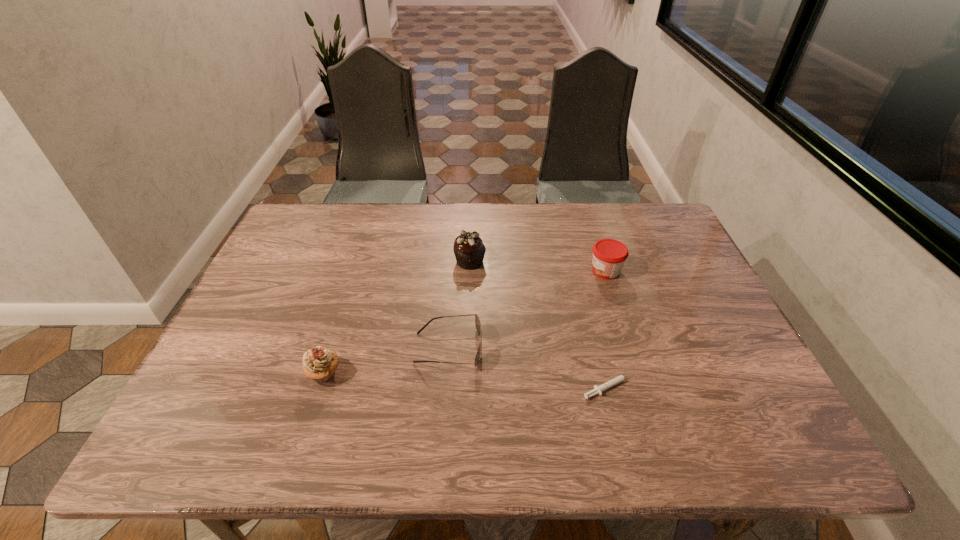
At what (x,y) coordinates should I click in order to perform the action: click on free space between the syringe and the second shortest object. Please return your answer as a coordinate pair (x, y). The height and width of the screenshot is (540, 960). Looking at the image, I should click on (529, 367).

Identify the location of free spot between the leftmost object and the third shortest object. The height and width of the screenshot is (540, 960). (465, 321).

This screenshot has height=540, width=960. Identify the location of free space between the left cupcake and the right cupcake. (396, 317).

Where is `vacant area between the nearer cupcake and the syringe`? vacant area between the nearer cupcake and the syringe is located at coordinates coord(468,380).

In order to click on free space that is in between the jam and the second shortest object in this screenshot , I will do `click(527, 309)`.

Where is `vacant area between the shortest object and the sunglasses`? vacant area between the shortest object and the sunglasses is located at coordinates (529, 367).

I want to click on empty space that is in between the sunglasses and the nearer cupcake, so click(386, 360).

Where is `object that is the fourth closest to the nearer cupcake`? object that is the fourth closest to the nearer cupcake is located at coordinates (609, 255).

Identify which object is the third nearest to the left cupcake. Please provide its 2D coordinates. Your answer should be formatted as a tuple, i.e. [(x, y)], where the tuple contains the x and y coordinates of a point satisfying the conditions above.

[(597, 389)]

This screenshot has width=960, height=540. In order to click on free space that satisfies the following two spatial constraints: 1. on the front side of the farther cupcake; 2. on the front-facing side of the fourth tallest object in this screenshot , I will do `click(468, 348)`.